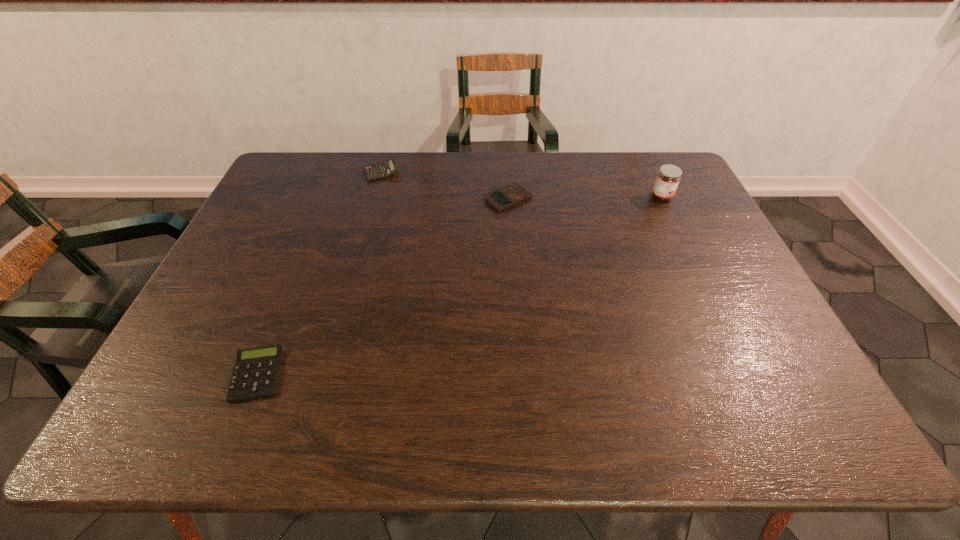
Image resolution: width=960 pixels, height=540 pixels. Find the location of `vacant space located 0.070m on the right of the second nearest calculator`. vacant space located 0.070m on the right of the second nearest calculator is located at coordinates (555, 199).

Where is `blank area located 0.240m on the right of the nearest object`? The width and height of the screenshot is (960, 540). blank area located 0.240m on the right of the nearest object is located at coordinates pyautogui.click(x=396, y=375).

At what (x,y) coordinates should I click in order to perform the action: click on jam that is at the far edge. Please return your answer as a coordinate pair (x, y). Looking at the image, I should click on (668, 177).

Where is `object that is at the near edge`? object that is at the near edge is located at coordinates (256, 372).

Where is `object present at the left edge`? object present at the left edge is located at coordinates (256, 372).

Find the location of a particular element. Image resolution: width=960 pixels, height=540 pixels. object at the right edge is located at coordinates (668, 177).

Locate an element on the screen. Image resolution: width=960 pixels, height=540 pixels. object at the near left corner is located at coordinates (256, 372).

Find the location of a particular element. object that is positioned at the far right corner is located at coordinates (668, 177).

Find the location of a particular element. This screenshot has height=540, width=960. vacant space at the far edge of the desktop is located at coordinates (517, 169).

This screenshot has height=540, width=960. Find the location of `free location at the left edge`. free location at the left edge is located at coordinates (239, 253).